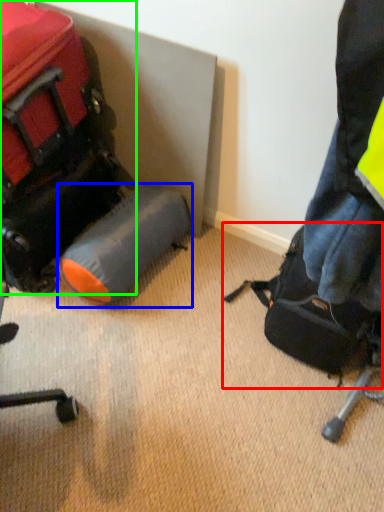
Question: Which object is the farthest from luggage and bags (highlighted by a red box)? Choose among these: luggage (highlighted by a blue box) or luggage and bags (highlighted by a green box).

Choices:
 (A) luggage
 (B) luggage and bags

Answer: (B)